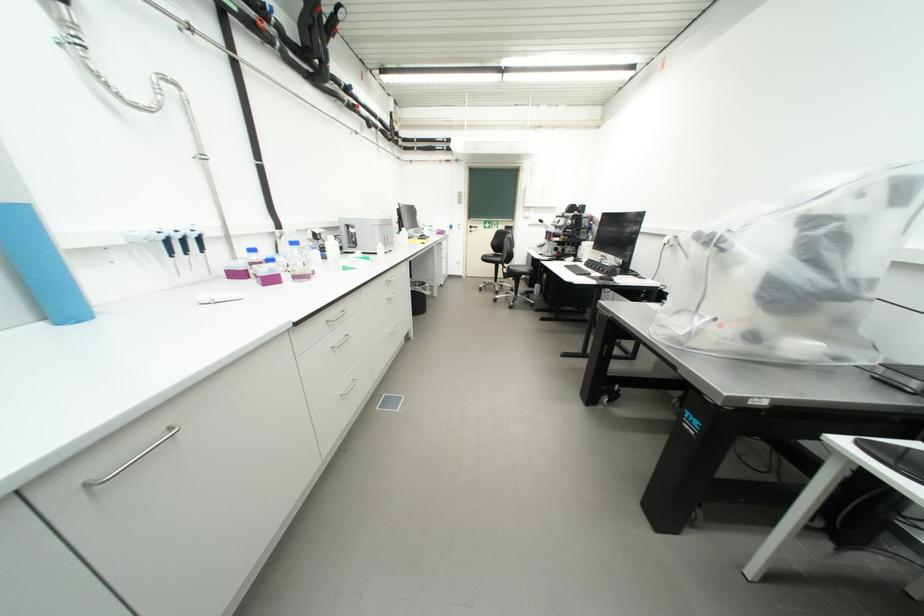
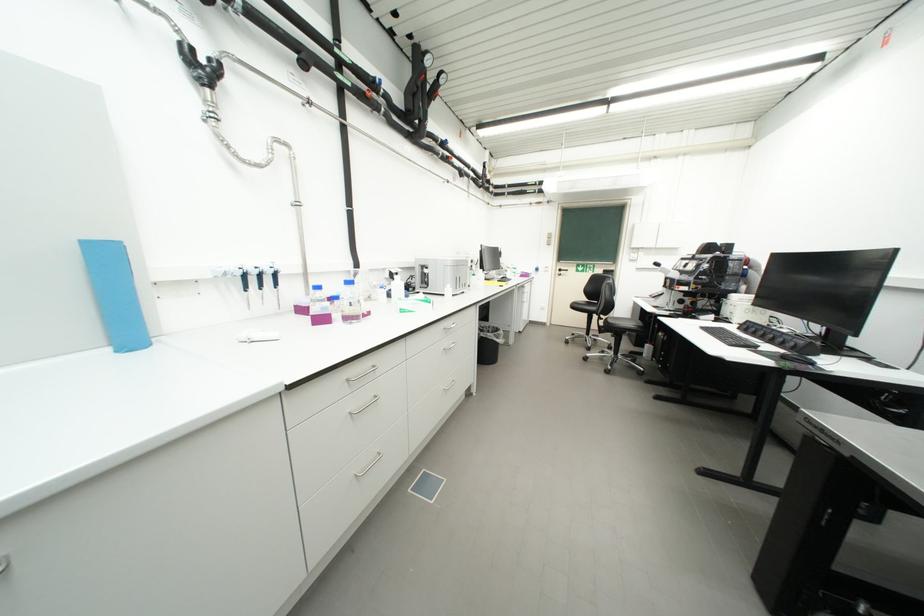
The point at (334,323) is marked in the first image. Where is the corresponding point in the second image?

(356, 381)